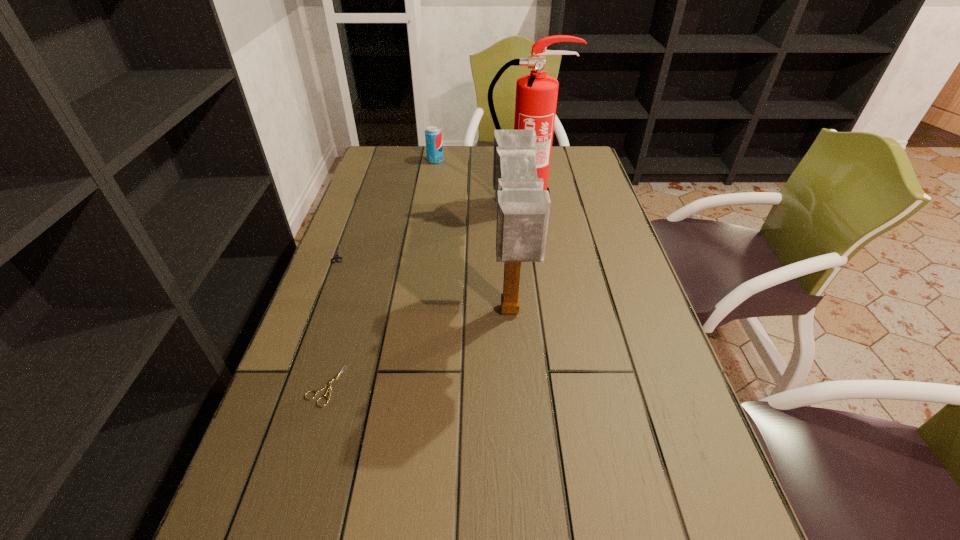
Identify which object is located as the fourth nearest to the left shears. Please provide its 2D coordinates. Your answer should be formatted as a tuple, i.e. [(x, y)], where the tuple contains the x and y coordinates of a point satisfying the conditions above.

[(433, 135)]

At what (x,y) coordinates should I click in order to perform the action: click on object that is the second closest to the farther shears. Please return your answer as a coordinate pair (x, y). Looking at the image, I should click on (523, 208).

At what (x,y) coordinates should I click in order to perform the action: click on free point that satisfies the following two spatial constraints: 1. on the front side of the fourth farthest object; 2. on the right side of the soda can. Please return your answer as a coordinate pair (x, y). Image resolution: width=960 pixels, height=540 pixels. Looking at the image, I should click on (411, 312).